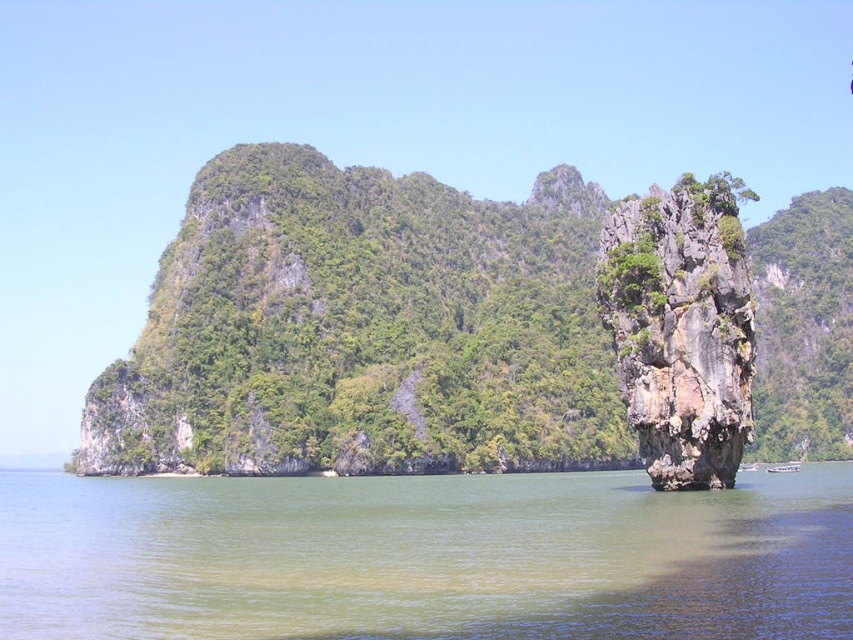
You are a kayaker planning to navigate between the rocky island and the green water at center. The kayaks you have are 80 feet long. Will your kayak fit through the narrowest part of the channel between them?

The distance between the rocky island and the green water at center is 84.73 feet. Since the kayak is 80 feet long, it will fit through the narrowest part of the channel as there is enough space.

You are a kayaker planning to navigate between the green water at center and the rugged stone rock at right. Which path has a wider passage for your kayak?

The green water at center has a wider passage than the rugged stone rock at right because its width surpasses the rock.

You are a kayaker approaching the island. You see the green water at center and the rugged stone rock at right. Which one is closer to your current position?

The green water at center is in front of rugged stone rock at right, so the green water at center is closer to your current position.